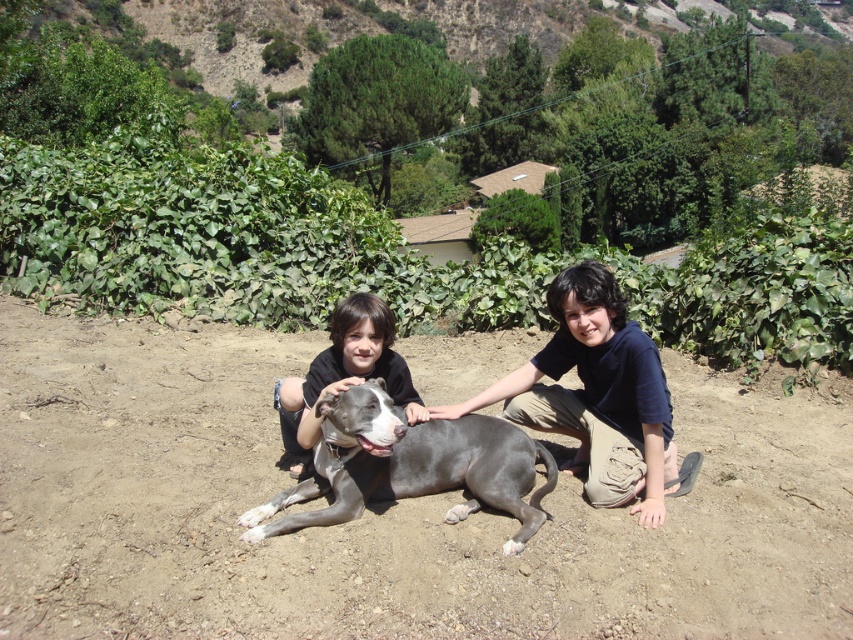
Question: Which point is farther to the camera?

Choices:
 (A) (622, 449)
 (B) (376, 380)

Answer: (A)

Question: Which point is farther to the camera?

Choices:
 (A) dull brown dirt at center
 (B) gray smooth dog at center
 (C) matte black shirt at center

Answer: (C)

Question: Considering the relative positions of dull brown dirt at center and smooth gray dog at center in the image provided, where is dull brown dirt at center located with respect to smooth gray dog at center?

Choices:
 (A) right
 (B) left

Answer: (A)

Question: Which object is positioned farthest from the matte black shirt at center?

Choices:
 (A) dull brown dirt at center
 (B) gray smooth dog at center
 (C) smooth gray dog at center

Answer: (A)

Question: Does dull brown dirt at center have a smaller size compared to gray smooth dog at center?

Choices:
 (A) yes
 (B) no

Answer: (A)

Question: Is the position of smooth gray dog at center less distant than that of matte black shirt at center?

Choices:
 (A) yes
 (B) no

Answer: (B)